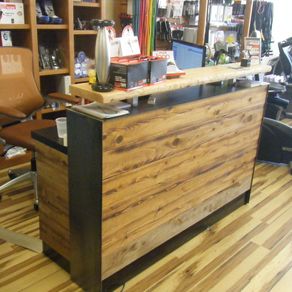
In order to click on crown symbol on chair in this screenshot , I will do (x=15, y=66).